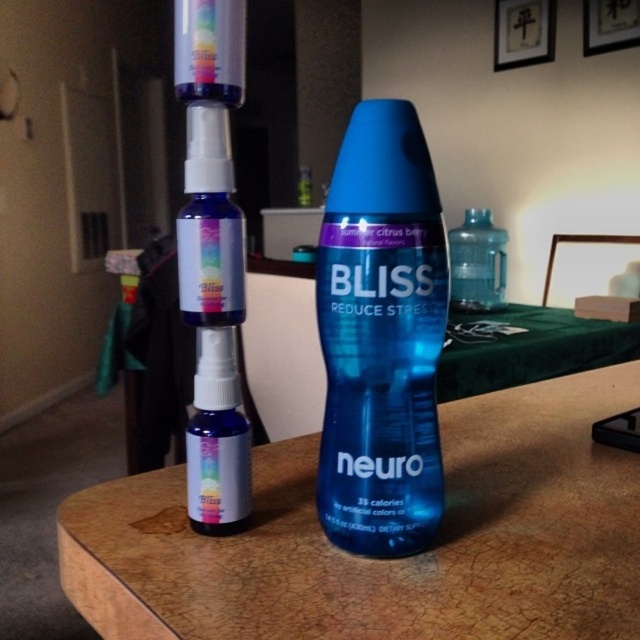
Looking at this image, can you confirm if matte plastic table at center is smaller than blue matte spray bottle at center?

Actually, matte plastic table at center might be larger than blue matte spray bottle at center.

Does point (560, 545) come farther from viewer compared to point (308, 166)?

No, (560, 545) is in front of (308, 166).

Between point (280, 516) and point (307, 198), which one is positioned in front?

Positioned in front is point (280, 516).

Locate an element on the screen. This screenshot has height=640, width=640. matte plastic table at center is located at coordinates (385, 560).

Can you confirm if matte plastic table at center is positioned above blue glossy bottle at center?

Incorrect, matte plastic table at center is not positioned above blue glossy bottle at center.

Between point (570, 410) and point (385, 340), which one is positioned in front?

Point (385, 340) is in front.

Is point (464, 609) farther from viewer compared to point (355, 275)?

No, it is in front of (355, 275).

The width and height of the screenshot is (640, 640). In order to click on matte plastic table at center in this screenshot , I will do coord(385,560).

Between matte glass spray bottle at center and transparent plastic water bottle at center, which one appears on the left side from the viewer's perspective?

matte glass spray bottle at center

Who is higher up, matte glass spray bottle at center or transparent plastic water bottle at center?

Positioned higher is transparent plastic water bottle at center.

Who is more forward, (234, 406) or (476, 230)?

Point (234, 406) is more forward.

Locate an element on the screen. matte glass spray bottle at center is located at coordinates (218, 438).